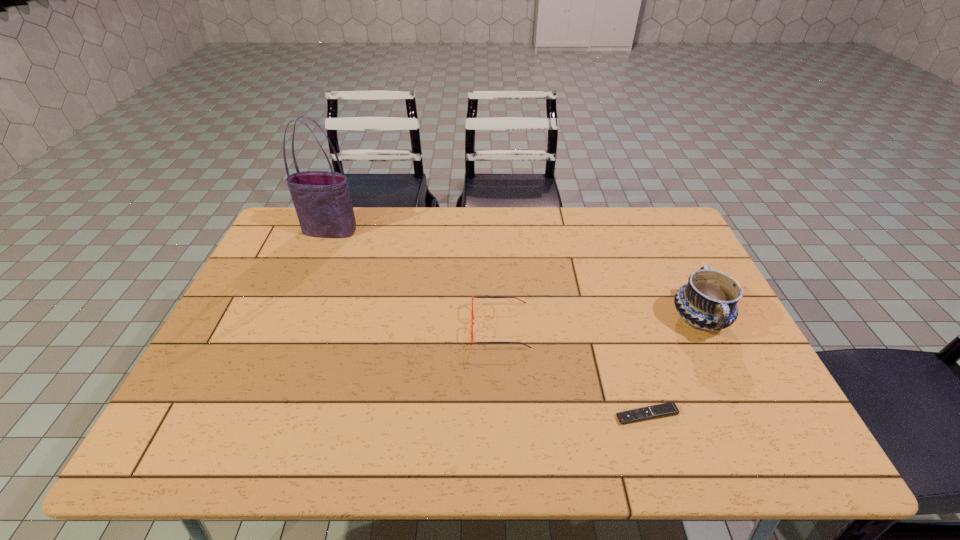
The image size is (960, 540). Identify the location of free space at the near edge. (481, 450).

In the image, there is a desktop. Identify the location of free space at the left edge. The height and width of the screenshot is (540, 960). (308, 253).

At what (x,y) coordinates should I click in order to perform the action: click on free space at the right edge of the desktop. Please return your answer as a coordinate pair (x, y). Looking at the image, I should click on (780, 421).

The image size is (960, 540). Find the location of `free space at the near left corner of the desktop`. free space at the near left corner of the desktop is located at coordinates (186, 460).

Image resolution: width=960 pixels, height=540 pixels. Identify the location of vacant space at the far right corner of the desktop. (652, 237).

Find the location of a particular element. The width and height of the screenshot is (960, 540). free space at the near right corner of the desktop is located at coordinates (762, 431).

The width and height of the screenshot is (960, 540). I want to click on free spot between the rightmost object and the second shortest object, so click(600, 323).

You are a GUI agent. You are given a task and a screenshot of the screen. Output one action in this format:
    pyautogui.click(x=<x>, y=<y>)
    Task: Click on the vacant region between the leftmost object and the third object from right to left
    
    Given the screenshot: What is the action you would take?
    (416, 279)

I want to click on vacant point located between the third object from left to right and the leftmost object, so click(489, 323).

Image resolution: width=960 pixels, height=540 pixels. I want to click on blank region between the third tallest object and the rightmost object, so click(x=600, y=323).